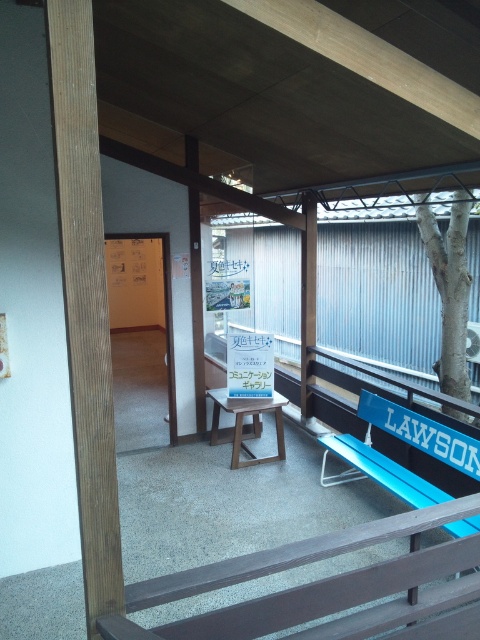
You are standing in the outdoor seating area and want to know which object is taller between the brown wood at left and the white textured tree at right. Can you determine this?

The brown wood at left is not as tall as the white textured tree at right, so the white textured tree at right is taller.

You are a visitor in this outdoor area and want to sit down. Which object, the blue plastic bench at right or the white textured tree at right, is lower to the ground and thus more suitable for sitting?

The blue plastic bench at right is shorter than the white textured tree at right, so it is lower to the ground and more suitable for sitting.